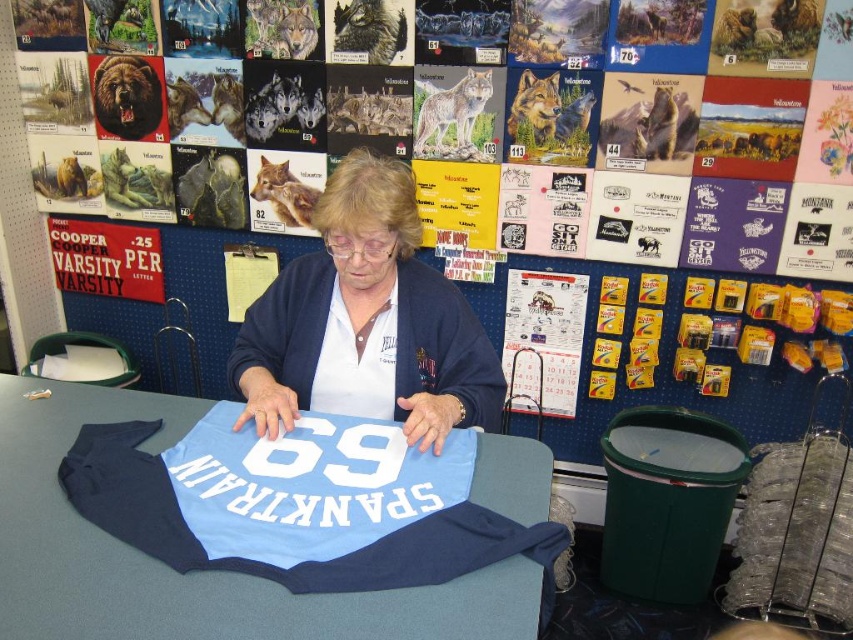
Who is taller, blue fabric shirt at center or white cotton t-shirt at center?

blue fabric shirt at center

How far apart are blue fabric shirt at center and white cotton t-shirt at center?

blue fabric shirt at center and white cotton t-shirt at center are 3.73 inches apart.

The image size is (853, 640). What do you see at coordinates (366, 323) in the screenshot?
I see `blue fabric shirt at center` at bounding box center [366, 323].

Locate an element on the screen. blue fabric shirt at center is located at coordinates (366, 323).

Where is `light blue fabric shirt at center`? light blue fabric shirt at center is located at coordinates (190, 573).

Does point (73, 545) come farther from viewer compared to point (413, 387)?

That is False.

Identify the location of light blue fabric shirt at center. The width and height of the screenshot is (853, 640). (190, 573).

Who is taller, light blue fabric shirt at center or white cotton t-shirt at center?

white cotton t-shirt at center is taller.

Is light blue fabric shirt at center shorter than white cotton t-shirt at center?

Indeed, light blue fabric shirt at center has a lesser height compared to white cotton t-shirt at center.

Where is `light blue fabric shirt at center`? light blue fabric shirt at center is located at coordinates (190, 573).